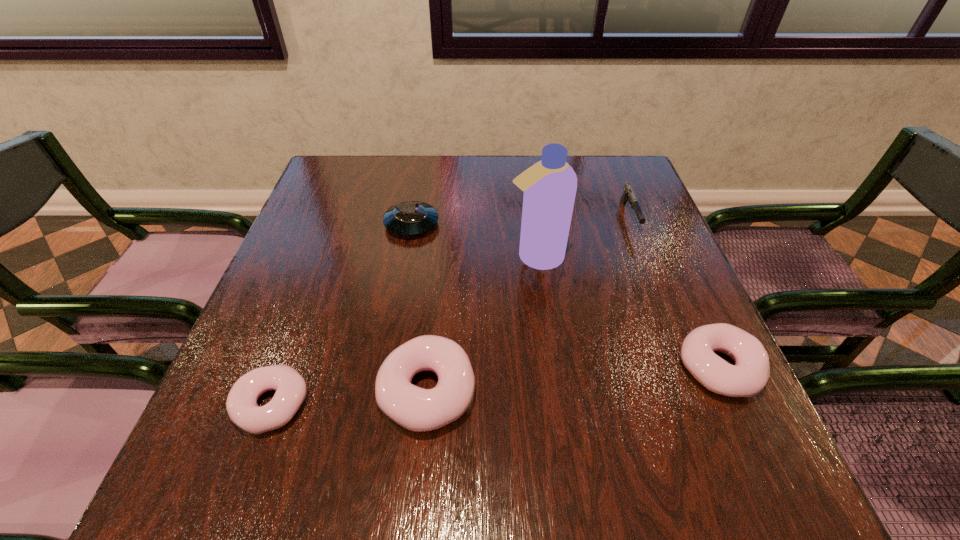
Identify the location of vacant position in the image that satisfies the following two spatial constraints: 1. on the front side of the second doughnut from right to left; 2. on the left side of the saucer. The image size is (960, 540). (382, 392).

Identify the location of free location that satisfies the following two spatial constraints: 1. at the muzzle end of the gun; 2. on the left side of the second shortest doughnut. Image resolution: width=960 pixels, height=540 pixels. (687, 368).

This screenshot has width=960, height=540. Find the location of `vacant space that satisfies the following two spatial constraints: 1. on the back side of the second doughnut from right to left; 2. on the left side of the fourth nearest object`. vacant space that satisfies the following two spatial constraints: 1. on the back side of the second doughnut from right to left; 2. on the left side of the fourth nearest object is located at coordinates pyautogui.click(x=440, y=257).

Locate an element on the screen. Image resolution: width=960 pixels, height=540 pixels. vacant space that satisfies the following two spatial constraints: 1. at the muzzle end of the gun; 2. on the left side of the second tallest doughnut is located at coordinates (687, 368).

Find the location of a particular element. Image resolution: width=960 pixels, height=540 pixels. vacant point that satisfies the following two spatial constraints: 1. on the back side of the shortest doughnut; 2. on the left side of the saucer is located at coordinates (338, 224).